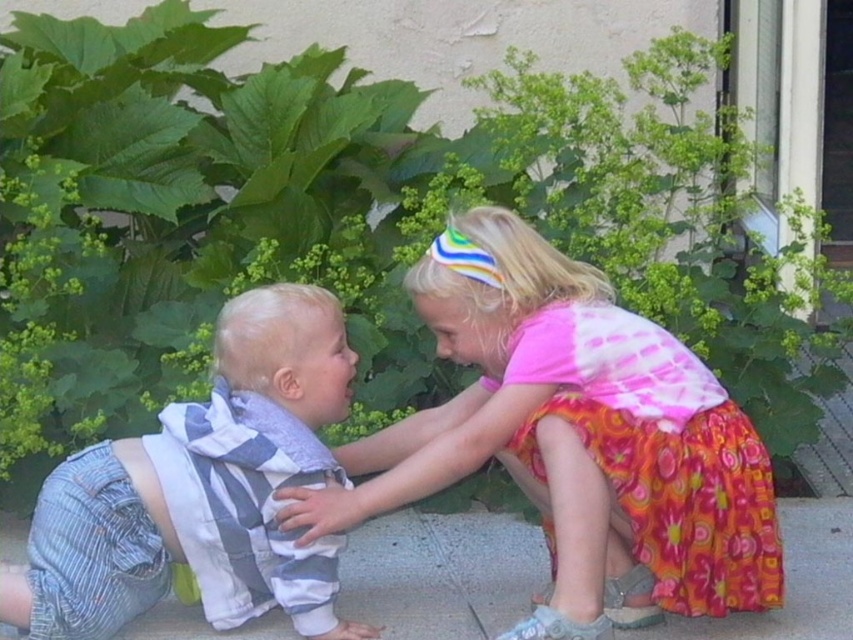
Is point (357, 488) less distant than point (247, 618)?

Yes.

Between point (628, 467) and point (308, 605), which one is positioned behind?

The point (308, 605) is behind.

Is point (325, 531) more distant than point (238, 352)?

No, it is in front of (238, 352).

Image resolution: width=853 pixels, height=640 pixels. Find the location of `multicolored fabric dress at center`. multicolored fabric dress at center is located at coordinates pyautogui.click(x=573, y=432).

Does striped cotton shirt at lower left have a lesser width compared to floral cotton dress at lower right?

Incorrect, striped cotton shirt at lower left's width is not less than floral cotton dress at lower right's.

Locate an element on the screen. Image resolution: width=853 pixels, height=640 pixels. striped cotton shirt at lower left is located at coordinates pyautogui.click(x=212, y=484).

Does multicolored fabric dress at center have a greater height compared to floral cotton dress at lower right?

Correct, multicolored fabric dress at center is much taller as floral cotton dress at lower right.

Which is more to the left, multicolored fabric dress at center or floral cotton dress at lower right?

From the viewer's perspective, multicolored fabric dress at center appears more on the left side.

Is point (573, 264) behind point (693, 560)?

Yes, point (573, 264) is behind point (693, 560).

Find the location of a particular element. The image size is (853, 640). multicolored fabric dress at center is located at coordinates (573, 432).